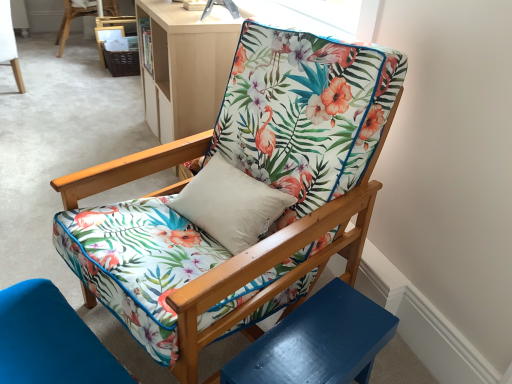
Locate an element on the screen. matte wood bookshelf at upper center is located at coordinates coord(183,66).

What do you see at coordinates (254, 178) in the screenshot?
I see `floral fabric chair at center, which is the second chair from bottom to top` at bounding box center [254, 178].

Where is `floral fabric chair at upper center, the 3th chair from the front`? The height and width of the screenshot is (384, 512). floral fabric chair at upper center, the 3th chair from the front is located at coordinates (9, 43).

Identify the location of floral fabric cushion at lower left, which is the 2th chair in right-to-left order. The width and height of the screenshot is (512, 384). (50, 340).

The width and height of the screenshot is (512, 384). I want to click on matte wood bookshelf at upper center, so click(183, 66).

Is the surface of glossy blue side table at lower right in direct contact with floral fabric chair at center, which is the second chair from bottom to top?

No.

This screenshot has height=384, width=512. In the image, there is a floral fabric chair at center, which is the first chair from front to back. Identify the location of side table below it (from a real-world perspective). (317, 342).

Considering the points (342, 369) and (255, 315), which point is in front, point (342, 369) or point (255, 315)?

The point (342, 369) is in front.

Does glossy blue side table at lower right have a greater height compared to floral fabric chair at center, the 4th chair viewed from the back?

In fact, glossy blue side table at lower right may be shorter than floral fabric chair at center, the 4th chair viewed from the back.

How far apart are floral fabric cushion at lower left, acting as the fourth chair starting from the top, and floral fabric chair at upper center, arranged as the second chair when viewed from the top?

7.99 feet.

Which is closer to the camera, (26, 314) or (18, 74)?

Point (26, 314)

Can you confirm if floral fabric cushion at lower left, the first chair in the bottom-to-top sequence, is taller than floral fabric chair at upper center, the 3th chair from the front?

In fact, floral fabric cushion at lower left, the first chair in the bottom-to-top sequence, may be shorter than floral fabric chair at upper center, the 3th chair from the front.

Is floral fabric chair at upper center, the fourth chair when ordered from right to left, aimed at glossy blue side table at lower right?

No.

Considering the relative sizes of floral fabric chair at upper center, arranged as the second chair when viewed from the top, and glossy blue side table at lower right in the image provided, is floral fabric chair at upper center, arranged as the second chair when viewed from the top, smaller than glossy blue side table at lower right?

No, floral fabric chair at upper center, arranged as the second chair when viewed from the top, is not smaller than glossy blue side table at lower right.

From a real-world perspective, is floral fabric chair at upper center, which appears as the 3th chair when ordered from the bottom, physically located above or below glossy blue side table at lower right?

floral fabric chair at upper center, which appears as the 3th chair when ordered from the bottom, is situated higher than glossy blue side table at lower right in the real world.

Could you measure the distance between floral fabric chair at upper center, arranged as the second chair when viewed from the top, and glossy blue side table at lower right?

floral fabric chair at upper center, arranged as the second chair when viewed from the top, and glossy blue side table at lower right are 9.40 feet apart from each other.

From a real-world perspective, is floral fabric chair at upper center, which appears as the 3th chair when ordered from the bottom, physically located above or below matte wood bookshelf at upper center?

floral fabric chair at upper center, which appears as the 3th chair when ordered from the bottom, is below matte wood bookshelf at upper center.

Which object is positioned more to the right, floral fabric chair at upper center, which is the first chair in left-to-right order, or matte wood bookshelf at upper center?

From the viewer's perspective, matte wood bookshelf at upper center appears more on the right side.

You are a GUI agent. You are given a task and a screenshot of the screen. Output one action in this format:
    pyautogui.click(x=<x>, y=<y>)
    Task: Click on the chair that is the 1st object located above the matte wood bookshelf at upper center (from the image's perspective)
    Image resolution: width=512 pixels, height=384 pixels.
    Given the screenshot: What is the action you would take?
    (x=9, y=43)

Is floral fabric chair at center, which is the second chair from bottom to top, far away from floral fabric chair at upper center, which is counted as the third chair, starting from the right?

Absolutely, floral fabric chair at center, which is the second chair from bottom to top, is distant from floral fabric chair at upper center, which is counted as the third chair, starting from the right.

Which is less distant, (319,241) or (79,14)?

The point (319,241) is closer to the camera.

From a real-world perspective, is floral fabric chair at center, the 4th chair viewed from the back, located beneath floral fabric chair at upper center, which is counted as the third chair, starting from the right?

Incorrect, from a real-world perspective, floral fabric chair at center, the 4th chair viewed from the back, is higher than floral fabric chair at upper center, which is counted as the third chair, starting from the right.

From the image's perspective, which is above, floral fabric chair at center, which is the first chair from front to back, or floral fabric chair at upper center, which is counted as the third chair, starting from the right?

From the image's view, floral fabric chair at upper center, which is counted as the third chair, starting from the right, is above.

From a real-world perspective, is matte wood bookshelf at upper center on floral fabric chair at upper center, arranged as the fourth chair when viewed from the front?

Yes, from a real-world perspective, matte wood bookshelf at upper center is over floral fabric chair at upper center, arranged as the fourth chair when viewed from the front

From the image's perspective, is matte wood bookshelf at upper center under floral fabric chair at upper center, which is counted as the third chair, starting from the right?

Indeed, from the image's perspective, matte wood bookshelf at upper center is shown beneath floral fabric chair at upper center, which is counted as the third chair, starting from the right.

Considering the positions of points (215, 59) and (114, 0), is point (215, 59) farther from camera compared to point (114, 0)?

That is False.

Is matte wood bookshelf at upper center outside of floral fabric chair at upper center, the second chair in the left-to-right sequence?

Yes, matte wood bookshelf at upper center is outside of floral fabric chair at upper center, the second chair in the left-to-right sequence.

Is the position of floral fabric cushion at lower left, which is counted as the 3th chair, starting from the left, less distant than that of floral fabric chair at center, the 4th chair viewed from the back?

No, floral fabric cushion at lower left, which is counted as the 3th chair, starting from the left, is further to the viewer.

Is floral fabric cushion at lower left, which is the 2th chair in right-to-left order, far from floral fabric chair at center, which is the second chair from bottom to top?

No, floral fabric cushion at lower left, which is the 2th chair in right-to-left order, is not far from floral fabric chair at center, which is the second chair from bottom to top.

What's the angular difference between floral fabric cushion at lower left, the first chair in the bottom-to-top sequence, and floral fabric chair at center, the 1th chair in the right-to-left sequence,'s facing directions?

There is a 0.000427-degree angle between the facing directions of floral fabric cushion at lower left, the first chair in the bottom-to-top sequence, and floral fabric chair at center, the 1th chair in the right-to-left sequence.

Is floral fabric cushion at lower left, acting as the fourth chair starting from the top, located outside floral fabric chair at center, which is the second chair from bottom to top?

Yes, floral fabric cushion at lower left, acting as the fourth chair starting from the top, is outside of floral fabric chair at center, which is the second chair from bottom to top.

This screenshot has width=512, height=384. I want to click on side table below the floral fabric chair at center, which appears as the 3th chair when viewed from the top (from a real-world perspective), so click(317, 342).

Find the location of `chair that is the 1st object located in front of the floral fabric chair at upper center, the 3th chair from the front`. chair that is the 1st object located in front of the floral fabric chair at upper center, the 3th chair from the front is located at coordinates (50, 340).

Estimate the real-world distances between objects in this image. Which object is closer to floral fabric cushion at lower left, the second chair when ordered from front to back, floral fabric chair at upper center, the second chair in the left-to-right sequence, or glossy blue side table at lower right?

glossy blue side table at lower right.

Considering their positions, is glossy blue side table at lower right positioned closer to floral fabric chair at upper center, which is the 1th chair from top to bottom, than floral fabric chair at center, which appears as the 3th chair when viewed from the top?

floral fabric chair at center, which appears as the 3th chair when viewed from the top, is closer to floral fabric chair at upper center, which is the 1th chair from top to bottom.

When comparing their distances from glossy blue side table at lower right, does floral fabric cushion at lower left, the second chair when ordered from front to back, or floral fabric chair at upper center, which is the first chair in left-to-right order, seem further?

floral fabric chair at upper center, which is the first chair in left-to-right order.

Looking at this image, based on their spatial positions, is glossy blue side table at lower right or floral fabric cushion at lower left, the second chair when ordered from front to back, closer to floral fabric chair at upper center, the 1th chair viewed from the back?

floral fabric cushion at lower left, the second chair when ordered from front to back, lies closer to floral fabric chair at upper center, the 1th chair viewed from the back, than the other object.

From the image, which object appears to be nearer to matte wood bookshelf at upper center, floral fabric chair at upper center, arranged as the second chair when viewed from the top, or floral fabric chair at upper center, the second chair in the left-to-right sequence?

Among the two, floral fabric chair at upper center, arranged as the second chair when viewed from the top, is located nearer to matte wood bookshelf at upper center.

Considering their positions, is floral fabric chair at center, which is the second chair from bottom to top, positioned further to floral fabric chair at upper center, which is the first chair in left-to-right order, than matte wood bookshelf at upper center?

The object further to floral fabric chair at upper center, which is the first chair in left-to-right order, is floral fabric chair at center, which is the second chair from bottom to top.

Estimate the real-world distances between objects in this image. Which object is further from glossy blue side table at lower right, floral fabric chair at center, which is the second chair from bottom to top, or floral fabric cushion at lower left, the second chair when ordered from front to back?

floral fabric cushion at lower left, the second chair when ordered from front to back, is positioned further to the anchor glossy blue side table at lower right.

From the image, which object appears to be nearer to floral fabric chair at upper center, arranged as the second chair when viewed from the top, floral fabric cushion at lower left, which is the 2th chair in right-to-left order, or floral fabric chair at upper center, the 1th chair viewed from the back?

floral fabric chair at upper center, the 1th chair viewed from the back.

In order to click on chair between floral fabric cushion at lower left, which is the 2th chair in right-to-left order, and floral fabric chair at upper center, the second chair in the left-to-right sequence, in the front-back direction in this screenshot , I will do `click(9, 43)`.

Locate an element on the screen. chair positioned between floral fabric chair at center, the 4th chair viewed from the back, and matte wood bookshelf at upper center from near to far is located at coordinates coord(50,340).

Locate an element on the screen. This screenshot has height=384, width=512. chair between glossy blue side table at lower right and floral fabric chair at upper center, the 3th chair from the front, in the front-back direction is located at coordinates (50, 340).

Find the location of a particular element. The width and height of the screenshot is (512, 384). chair between floral fabric chair at center, the fourth chair from the left, and floral fabric chair at upper center, which is the first chair in left-to-right order, along the z-axis is located at coordinates (50, 340).